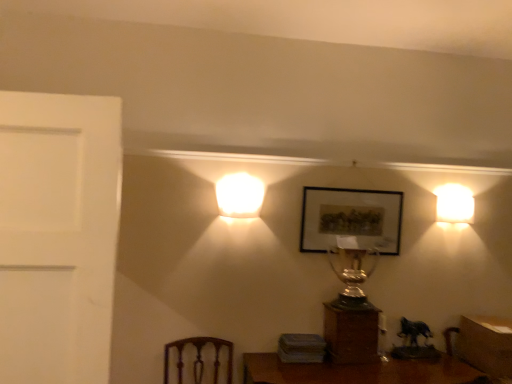
You are a GUI agent. You are given a task and a screenshot of the screen. Output one action in this format:
    pyautogui.click(x=<x>, y=<y>)
    Task: Click on the free space above white glossy wall sconce at right, the 1th lamp in the back-to-front sequence (from a real-world perspective)
    
    Given the screenshot: What is the action you would take?
    pyautogui.click(x=455, y=196)